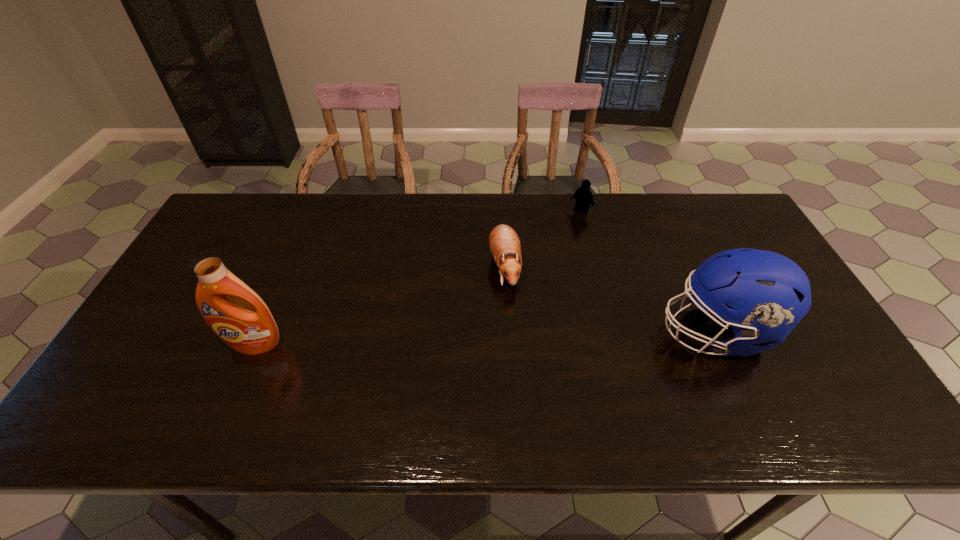
Find the location of a particular element. This screenshot has height=540, width=960. free space that is in between the farthest object and the leftmost object is located at coordinates (418, 278).

Identify the location of vacant space in between the second object from right to left and the third object from right to left. This screenshot has width=960, height=540. (542, 239).

Locate an element on the screen. free spot between the leftmost object and the second object from left to right is located at coordinates (379, 306).

At what (x,y) coordinates should I click in order to perform the action: click on vacant point located between the rightmost object and the detergent. Please return your answer as a coordinate pair (x, y). The height and width of the screenshot is (540, 960). Looking at the image, I should click on (486, 338).

At what (x,y) coordinates should I click in order to perform the action: click on vacant area that lies between the third object from left to right and the second farthest object. Please return your answer as a coordinate pair (x, y). Looking at the image, I should click on (542, 239).

Locate which object ranks in proximity to the football helmet. Please provide its 2D coordinates. Your answer should be formatted as a tuple, i.e. [(x, y)], where the tuple contains the x and y coordinates of a point satisfying the conditions above.

[(504, 243)]

Select which object appears as the second closest to the second farthest object. Please provide its 2D coordinates. Your answer should be formatted as a tuple, i.e. [(x, y)], where the tuple contains the x and y coordinates of a point satisfying the conditions above.

[(768, 293)]

Locate an element on the screen. This screenshot has width=960, height=540. vacant space that satisfies the following two spatial constraints: 1. on the front side of the rightmost object; 2. on the front-facing side of the farthest object is located at coordinates (612, 332).

You are a GUI agent. You are given a task and a screenshot of the screen. Output one action in this format:
    pyautogui.click(x=<x>, y=<y>)
    Task: Click on the free space that satisfies the following two spatial constraints: 1. on the back side of the third nearest object; 2. on the right side of the third object from left to right
    
    Given the screenshot: What is the action you would take?
    pyautogui.click(x=501, y=211)

Locate an element on the screen. This screenshot has height=540, width=960. free space that satisfies the following two spatial constraints: 1. on the front side of the third nearest object; 2. on the front-facing side of the second tallest object is located at coordinates (508, 332).